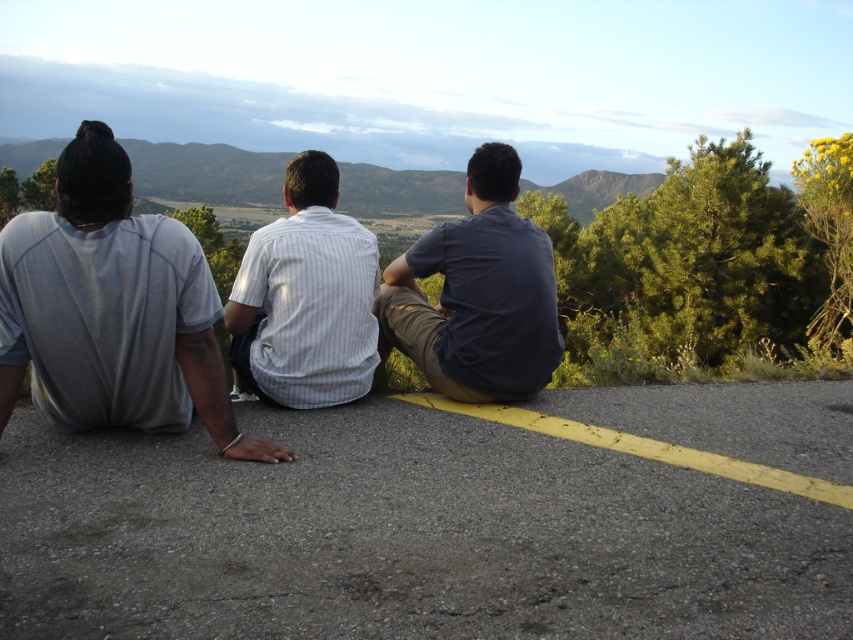
Question: Is dark blue shirt at center closer to the viewer compared to white striped shirt at center?

Choices:
 (A) no
 (B) yes

Answer: (A)

Question: Which object is the farthest from the gray cotton t-shirt at left?

Choices:
 (A) dark blue shirt at center
 (B) white striped shirt at center

Answer: (A)

Question: Can you confirm if gray cotton t-shirt at left is thinner than white striped shirt at center?

Choices:
 (A) no
 (B) yes

Answer: (A)

Question: Which of the following is the closest to the observer?

Choices:
 (A) (1, 320)
 (B) (508, 243)
 (C) (306, 288)

Answer: (A)

Question: Which of the following is the farthest from the observer?

Choices:
 (A) gray cotton t-shirt at left
 (B) white striped shirt at center
 (C) dark blue shirt at center

Answer: (C)

Question: Is dark blue shirt at center positioned in front of white striped shirt at center?

Choices:
 (A) no
 (B) yes

Answer: (A)